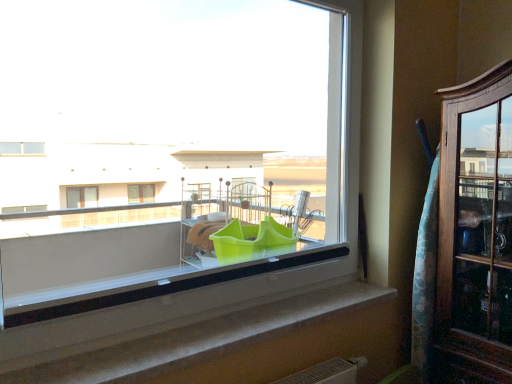
Question: Considering the relative sizes of wooden cabinet at right and green plastic container at center in the image provided, is wooden cabinet at right bigger than green plastic container at center?

Choices:
 (A) yes
 (B) no

Answer: (A)

Question: Considering the relative sizes of wooden cabinet at right and green plastic container at center in the image provided, is wooden cabinet at right thinner than green plastic container at center?

Choices:
 (A) yes
 (B) no

Answer: (B)

Question: From the image's perspective, would you say wooden cabinet at right is positioned over green plastic container at center?

Choices:
 (A) yes
 (B) no

Answer: (B)

Question: Is wooden cabinet at right completely or partially outside of green plastic container at center?

Choices:
 (A) no
 (B) yes

Answer: (B)

Question: Are wooden cabinet at right and green plastic container at center making contact?

Choices:
 (A) yes
 (B) no

Answer: (B)

Question: Looking at the image, does wooden cabinet at right seem bigger or smaller compared to smooth concrete window sill at center?

Choices:
 (A) big
 (B) small

Answer: (A)

Question: Based on their positions, is wooden cabinet at right located to the left or right of smooth concrete window sill at center?

Choices:
 (A) right
 (B) left

Answer: (A)

Question: In terms of width, does wooden cabinet at right look wider or thinner when compared to smooth concrete window sill at center?

Choices:
 (A) thin
 (B) wide

Answer: (B)

Question: From a real-world perspective, relative to smooth concrete window sill at center, is wooden cabinet at right vertically above or below?

Choices:
 (A) above
 (B) below

Answer: (A)

Question: Considering the relative positions of smooth concrete window sill at center and green plastic container at center in the image provided, is smooth concrete window sill at center to the left or to the right of green plastic container at center?

Choices:
 (A) right
 (B) left

Answer: (A)

Question: Is point (125, 349) closer or farther from the camera than point (76, 145)?

Choices:
 (A) farther
 (B) closer

Answer: (B)

Question: From a real-world perspective, is smooth concrete window sill at center positioned above or below green plastic container at center?

Choices:
 (A) below
 (B) above

Answer: (A)

Question: From the image's perspective, is smooth concrete window sill at center above or below green plastic container at center?

Choices:
 (A) above
 (B) below

Answer: (B)

Question: Which is correct: smooth concrete window sill at center is inside wooden cabinet at right, or outside of it?

Choices:
 (A) outside
 (B) inside

Answer: (A)

Question: From a real-world perspective, is smooth concrete window sill at center positioned above or below wooden cabinet at right?

Choices:
 (A) above
 (B) below

Answer: (B)